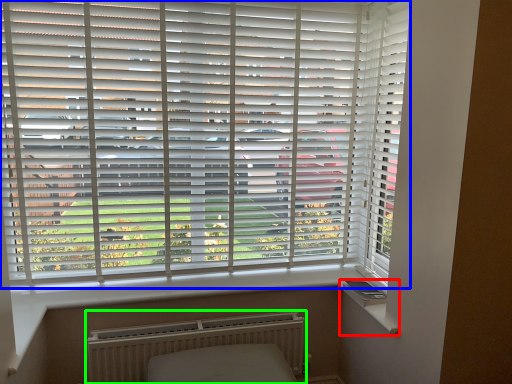
Question: Which object is positioned closest to window sill (highlighted by a red box)? Select from window blind (highlighted by a blue box) and radiator (highlighted by a green box).

Choices:
 (A) window blind
 (B) radiator

Answer: (B)